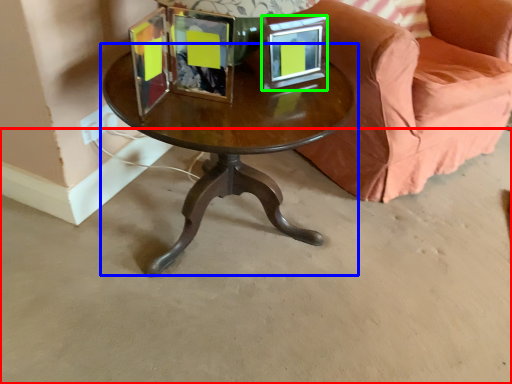
Question: Which object is positioned farthest from concrete (highlighted by a red box)? Select from coffee table (highlighted by a blue box) and picture frame (highlighted by a green box).

Choices:
 (A) coffee table
 (B) picture frame

Answer: (B)